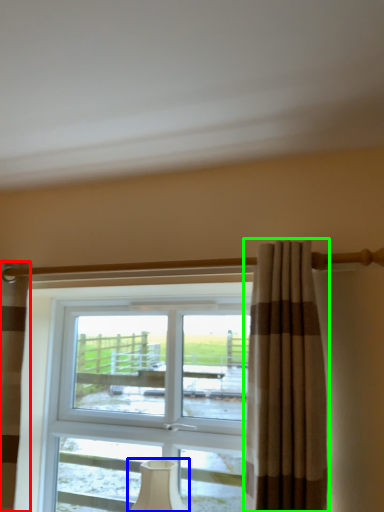
Question: Which is farther away from curtain (highlighted by a red box)? table lamp (highlighted by a blue box) or curtain (highlighted by a green box)?

Choices:
 (A) table lamp
 (B) curtain

Answer: (B)